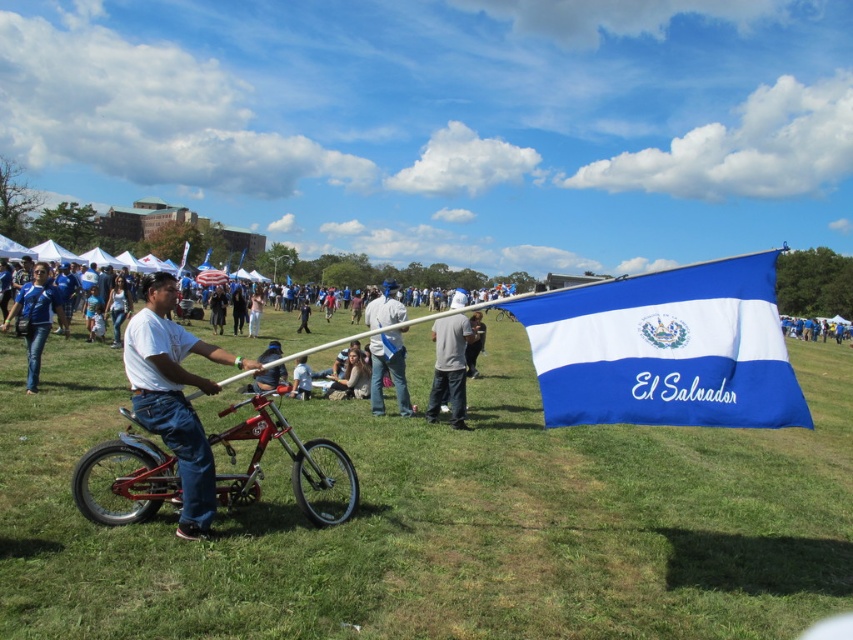
Question: Is light blue fabric flag at center positioned in front of matte blue shirt at left?

Choices:
 (A) yes
 (B) no

Answer: (A)

Question: Which object is positioned farthest from the blue fabric flag at center?

Choices:
 (A) white matte shirt at center
 (B) gray cotton shirt at center
 (C) matte blue shirt at left
 (D) light blue fabric flag at center

Answer: (C)

Question: Where is shiny red bicycle at center located in relation to matte blue shirt at left in the image?

Choices:
 (A) below
 (B) above

Answer: (A)

Question: Among these objects, which one is nearest to the camera?

Choices:
 (A) light blue fabric flag at center
 (B) shiny red bicycle at center
 (C) gray cotton shirt at center

Answer: (A)

Question: Which point is farther to the camera?

Choices:
 (A) matte blue shirt at left
 (B) shiny red bicycle at center

Answer: (A)

Question: Can you confirm if gray cotton shirt at center is positioned below light blue fabric flag at center?

Choices:
 (A) no
 (B) yes

Answer: (B)